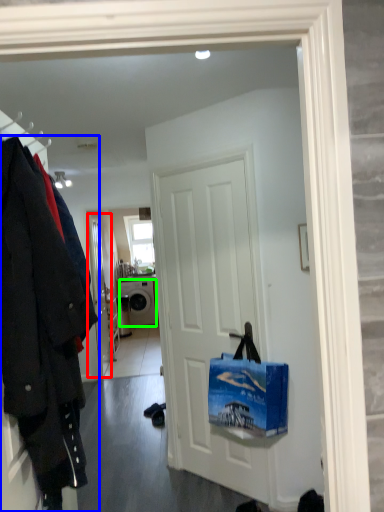
Question: Which object is positioned farthest from door (highlighted by a red box)? Select from coat (highlighted by a blue box) and washing machine (highlighted by a green box).

Choices:
 (A) coat
 (B) washing machine

Answer: (A)